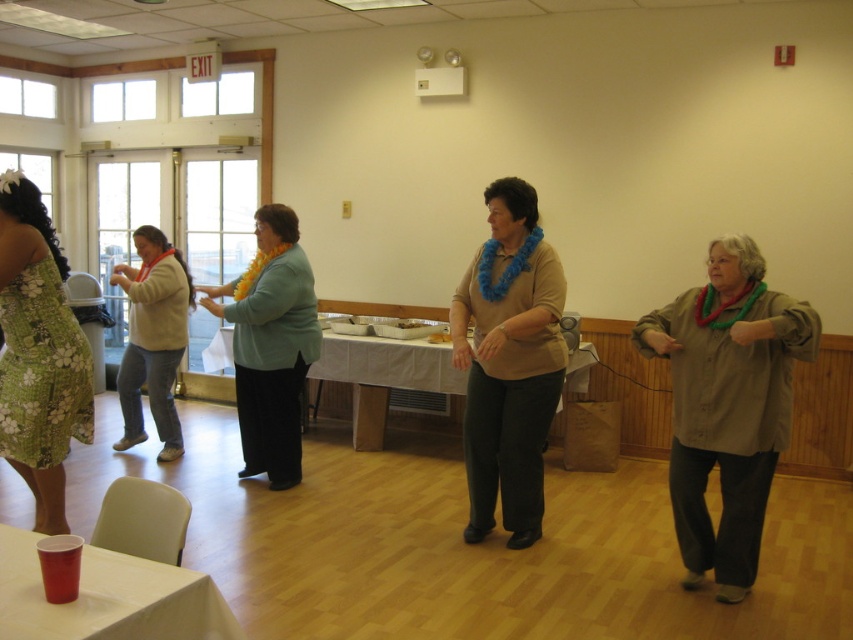
Question: Which point is closer to the camera?

Choices:
 (A) (751, 324)
 (B) (354, 387)
 (C) (288, 477)
 (D) (142, 280)

Answer: (A)

Question: Is teal fabric jacket at center positioned before beige sweater at left?

Choices:
 (A) yes
 (B) no

Answer: (A)

Question: Estimate the real-world distances between objects in this image. Which object is farther from the white cloth-covered table at center?

Choices:
 (A) matte brown shirt at right
 (B) red plastic cup at lower left

Answer: (B)

Question: In this image, where is red plastic cup at lower left located relative to white cloth-covered table at center?

Choices:
 (A) right
 (B) left

Answer: (B)

Question: Does blue fabric lei at center appear under red plastic cup at lower left?

Choices:
 (A) no
 (B) yes

Answer: (A)

Question: Which object appears farthest from the camera in this image?

Choices:
 (A) red plastic cup at lower left
 (B) beige sweater at left
 (C) white cloth-covered table at center

Answer: (C)